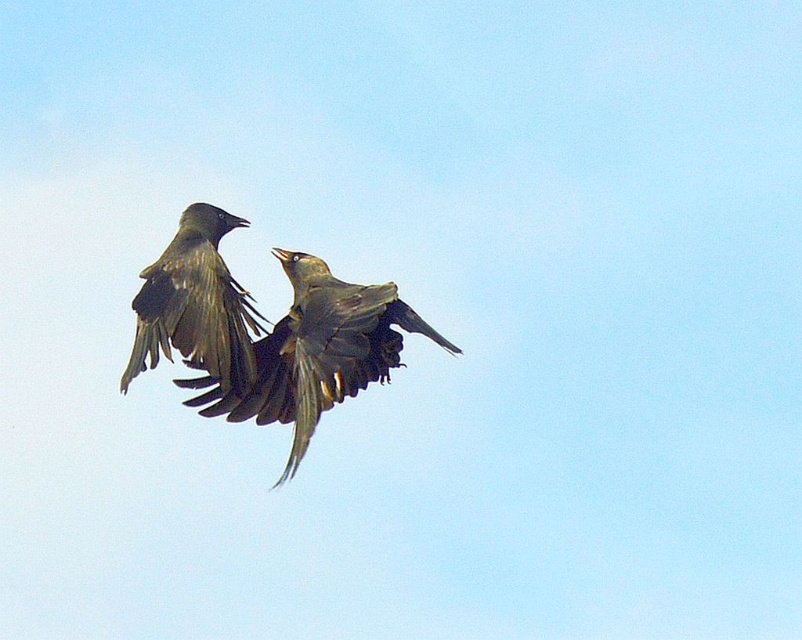
You are a birdwatcher trying to identify two crows in the sky. You notice two sets of dark gray feathers at center and dark gray feathers at upper left. Which set of feathers has a greater width?

The dark gray feathers at center has a greater width than the dark gray feathers at upper left.

You are an ornithologist observing two groups of dark gray feathers in the sky. You notice the dark gray feathers at center and the dark gray feathers at upper left. Which group of feathers appears larger in size?

The dark gray feathers at center appears larger in size than the dark gray feathers at upper left.